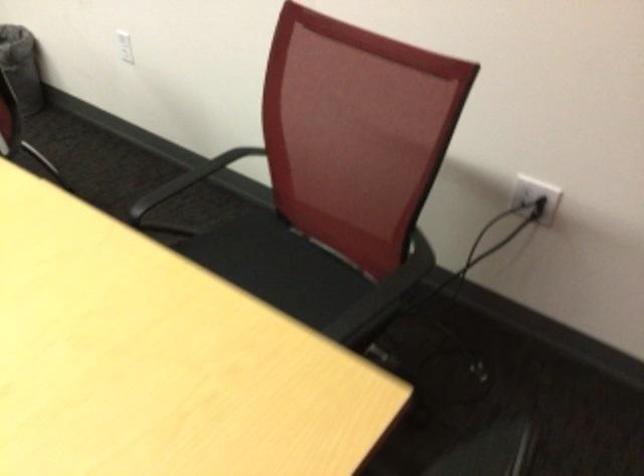
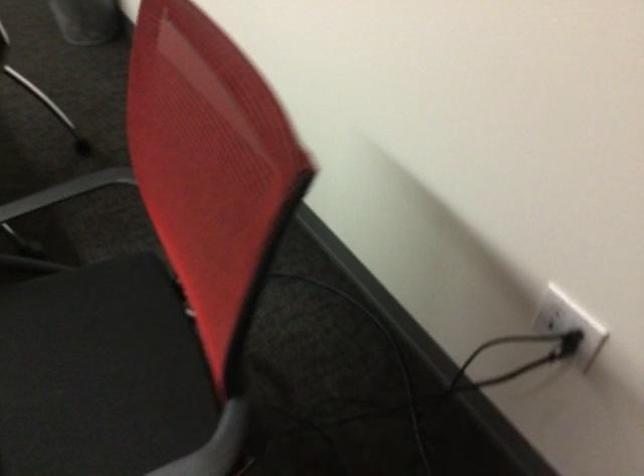
Question: The camera is either moving clockwise (left) or counter-clockwise (right) around the object. The first image is from the beginning of the video and the second image is from the end. Is the camera moving left or right when shooting the video?

Choices:
 (A) Left
 (B) Right

Answer: (B)